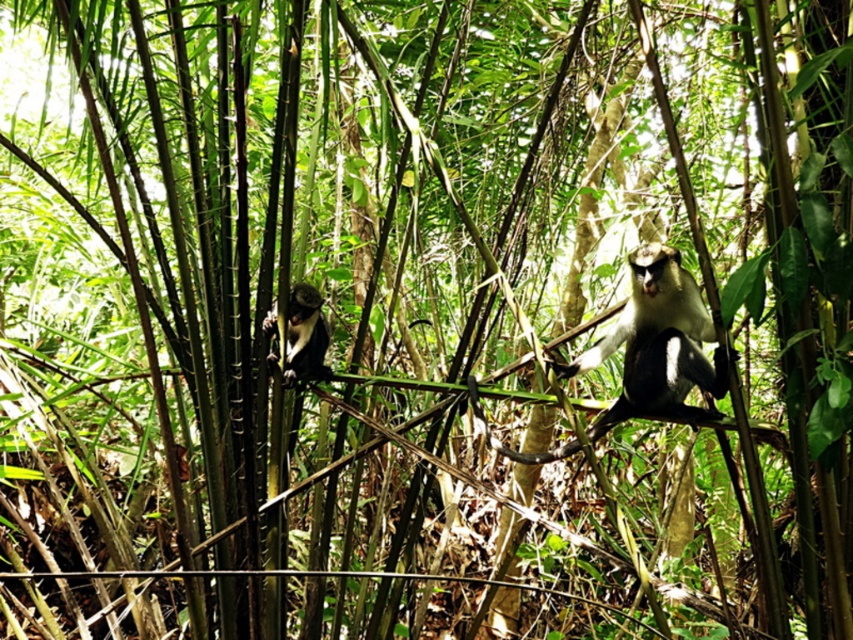
Question: Can you confirm if white fur monkey at center is thinner than black fur monkey at left?

Choices:
 (A) no
 (B) yes

Answer: (A)

Question: Which of the following is the closest to the observer?

Choices:
 (A) black fur monkey at left
 (B) white fur monkey at center

Answer: (B)

Question: Can you confirm if white fur monkey at center is positioned to the left of black fur monkey at left?

Choices:
 (A) yes
 (B) no

Answer: (B)

Question: Which point is farther to the camera?

Choices:
 (A) (650, 388)
 (B) (312, 356)

Answer: (B)

Question: Can you confirm if white fur monkey at center is positioned to the right of black fur monkey at left?

Choices:
 (A) yes
 (B) no

Answer: (A)

Question: Which of the following is the closest to the observer?

Choices:
 (A) black fur monkey at left
 (B) white fur monkey at center

Answer: (B)